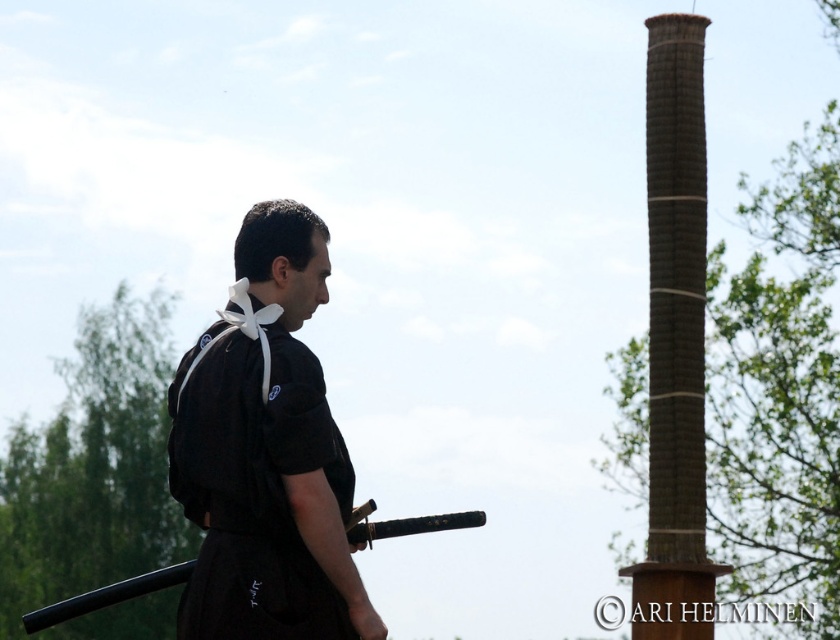
You are a photographer positioned at the origin point. The black matte kimono at center is at coordinates 0.713, 0.318. Can you capture the entire kimono in your camera frame without moving your position?

The black matte kimono at center is located at point (266, 456). Since the coordinates are within the camera frame range, you can capture the entire kimono without moving your position.

You are a martial arts instructor observing a student practicing with the black matte sword at center and standing near the brown textured pole at right. Which object takes up more visual space in the scene?

The black matte sword at center occupies more visual space than the brown textured pole at right because the description states that the brown textured pole at right occupies less space than the black matte sword at center.